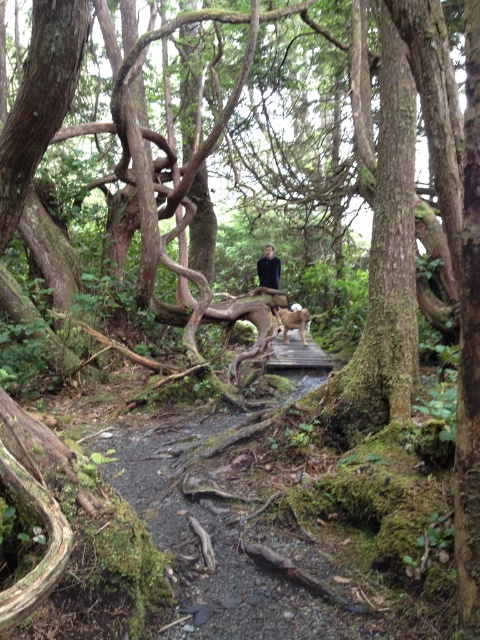
Between point (269, 262) and point (285, 336), which one is positioned behind?

Positioned behind is point (269, 262).

Can you confirm if black matte shirt at center is positioned below brown furry dog at center?

No, black matte shirt at center is not below brown furry dog at center.

Does point (276, 269) lie behind point (300, 326)?

Yes.

Where is `black matte shirt at center`? black matte shirt at center is located at coordinates (268, 268).